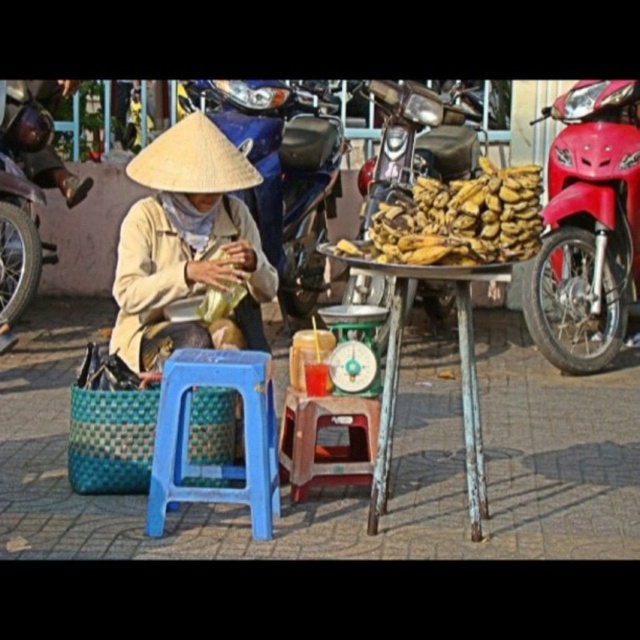
Does point (403, 196) come farther from viewer compared to point (483, 509)?

Yes, it is behind point (483, 509).

Which is more to the right, yellow matte bananas at center or rusty metal table at center?

rusty metal table at center is more to the right.

Who is more forward, (x=396, y=198) or (x=477, y=432)?

Point (x=477, y=432)

Identify the location of yellow matte bananas at center. (456, 220).

Find the location of a particular element. Image resolution: width=640 pixels, height=640 pixels. matte straw hat at center is located at coordinates (188, 246).

Is matte straw hat at center above blue plastic stool at lower center?

Yes.

Which is in front, point (161, 282) or point (275, 467)?

Point (275, 467)

You are a GUI agent. You are given a task and a screenshot of the screen. Output one action in this format:
    pyautogui.click(x=<x>, y=<y>)
    Task: Click on the matte straw hat at center
    The height and width of the screenshot is (640, 640).
    Given the screenshot: What is the action you would take?
    click(188, 246)

Who is more forward, (250,99) or (301,413)?

Point (301,413) is more forward.

Between point (308, 216) and point (280, 465), which one is positioned in front?

Point (280, 465) is in front.

Locate an element on the screen. brushed metal motorcycle at upper center is located at coordinates (282, 172).